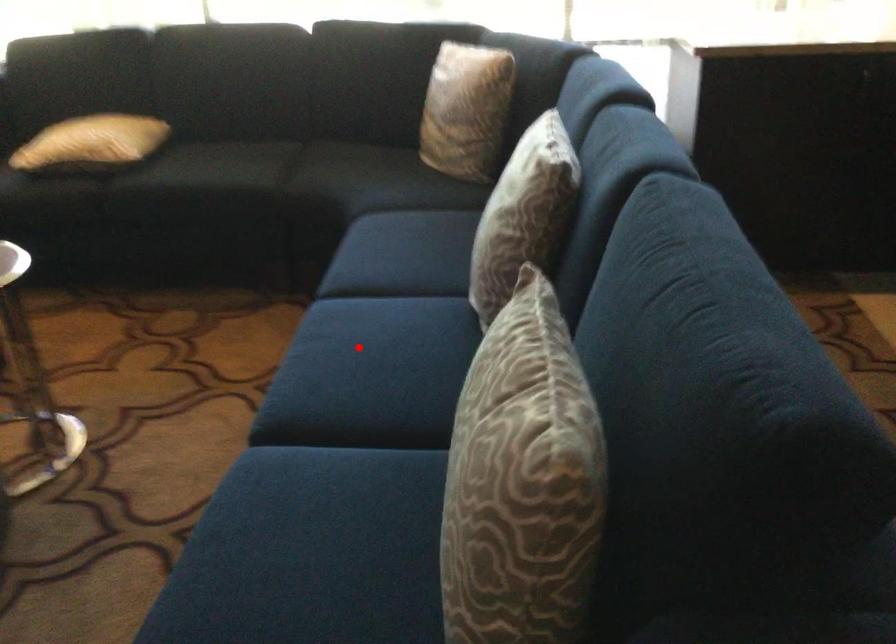
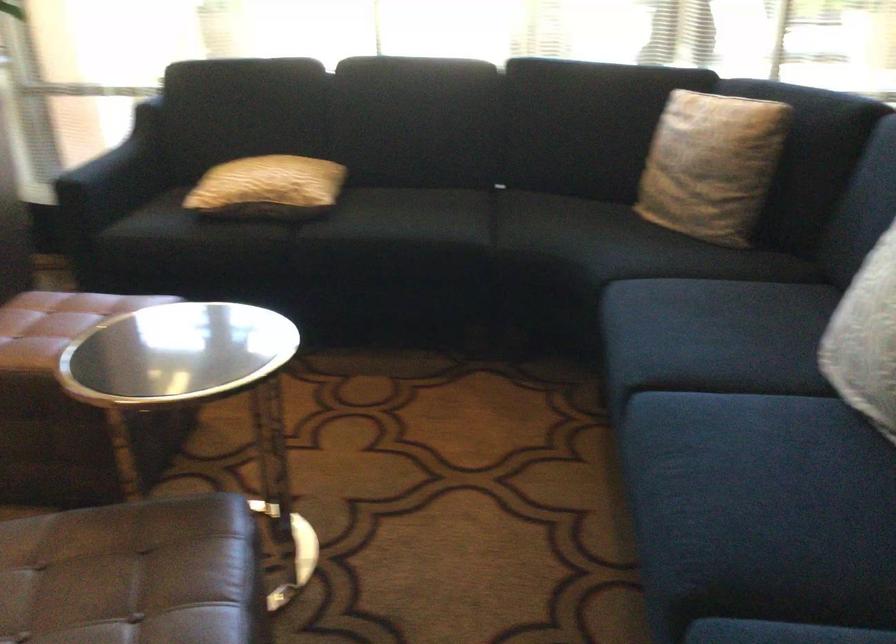
Question: I am providing you with two images of the same scene from different viewpoints. A red point is shown in image1. For the corresponding object point in image2, is it positioned nearer or farther from the camera?

Choices:
 (A) Nearer
 (B) Farther

Answer: (A)